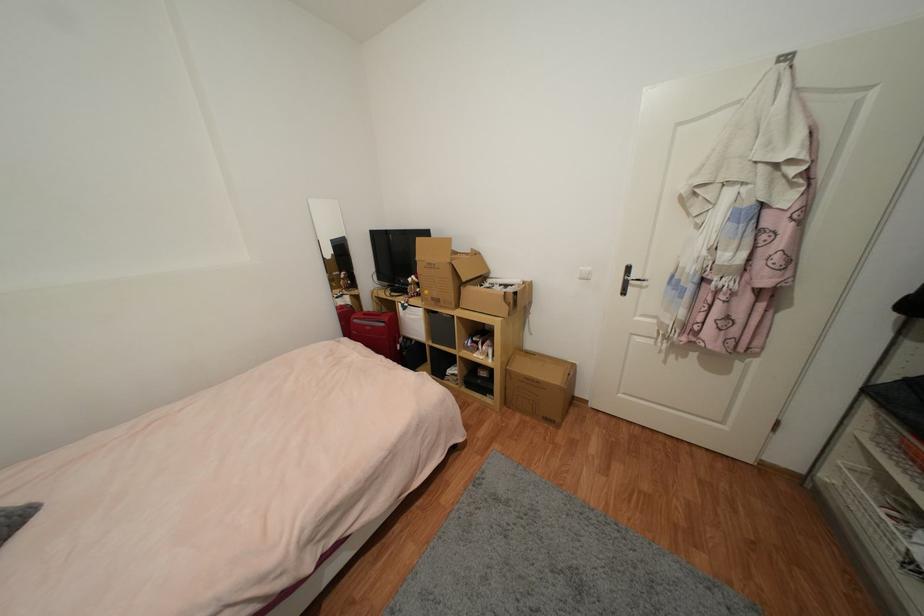
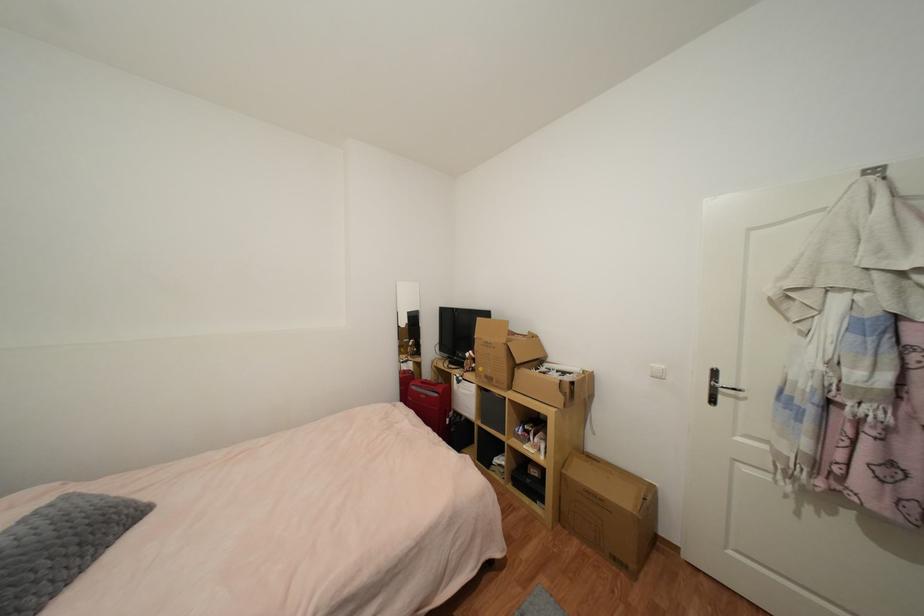
Find the pixel in the second image that matches (509,403) in the first image.

(564, 517)